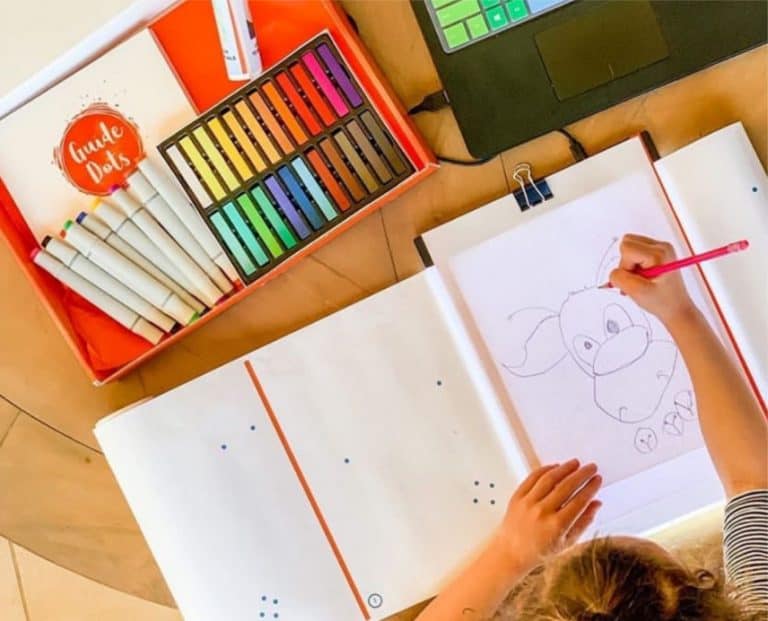
Locate an element on the screen. Image resolution: width=768 pixels, height=621 pixels. laptop is located at coordinates (500, 96).